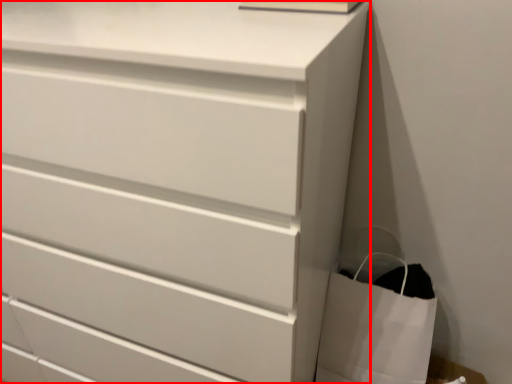
Question: From the image's perspective, what is the correct spatial positioning of chest of drawers (annotated by the red box) in reference to bag?

Choices:
 (A) below
 (B) above

Answer: (B)